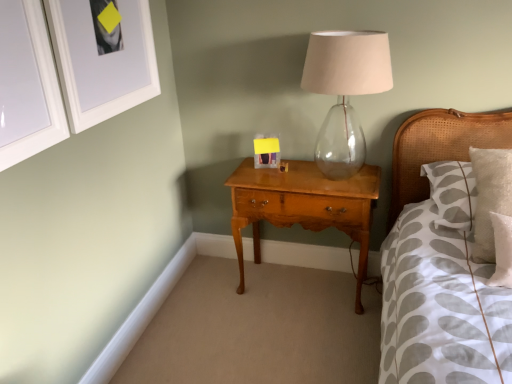
Question: From a real-world perspective, is white matte picture frame at upper left, acting as the second picture frame starting from the left, over matte plastic picture frame at center, marked as the 1th picture frame in a back-to-front arrangement?

Choices:
 (A) no
 (B) yes

Answer: (B)

Question: Can you confirm if white matte picture frame at upper left, acting as the second picture frame starting from the left, is positioned to the right of matte plastic picture frame at center, placed as the third picture frame when sorted from left to right?

Choices:
 (A) yes
 (B) no

Answer: (B)

Question: Can matte plastic picture frame at center, marked as the 1th picture frame in a back-to-front arrangement, be found inside white matte picture frame at upper left, acting as the second picture frame starting from the left?

Choices:
 (A) yes
 (B) no

Answer: (B)

Question: From the image's perspective, is white matte picture frame at upper left, arranged as the 2th picture frame when viewed from the front, above matte plastic picture frame at center, marked as the 3th picture frame in a front-to-back arrangement?

Choices:
 (A) no
 (B) yes

Answer: (B)

Question: From a real-world perspective, is white matte picture frame at upper left, arranged as the 2th picture frame when viewed from the front, physically below matte plastic picture frame at center, marked as the 1th picture frame in a back-to-front arrangement?

Choices:
 (A) yes
 (B) no

Answer: (B)

Question: Does white matte picture frame at upper left, acting as the second picture frame starting from the left, have a larger size compared to matte plastic picture frame at center, marked as the 1th picture frame in a back-to-front arrangement?

Choices:
 (A) yes
 (B) no

Answer: (A)

Question: Can you confirm if transparent glass table lamp at center is wider than white matte picture frame at upper left, arranged as the 2th picture frame when viewed from the front?

Choices:
 (A) no
 (B) yes

Answer: (B)

Question: Is transparent glass table lamp at center placed right next to white matte picture frame at upper left, acting as the second picture frame starting from the left?

Choices:
 (A) no
 (B) yes

Answer: (A)

Question: Is transparent glass table lamp at center far from white matte picture frame at upper left, the second picture frame from the back?

Choices:
 (A) no
 (B) yes

Answer: (A)

Question: From a real-world perspective, is transparent glass table lamp at center located beneath white matte picture frame at upper left, acting as the second picture frame starting from the left?

Choices:
 (A) no
 (B) yes

Answer: (B)

Question: Is transparent glass table lamp at center positioned behind white matte picture frame at upper left, the second picture frame from the back?

Choices:
 (A) yes
 (B) no

Answer: (A)

Question: From a real-world perspective, does transparent glass table lamp at center stand above white matte picture frame at upper left, acting as the second picture frame starting from the left?

Choices:
 (A) yes
 (B) no

Answer: (B)

Question: Would you say shiny brown wood nightstand at center is outside matte plastic picture frame at center, marked as the 1th picture frame in a back-to-front arrangement?

Choices:
 (A) yes
 (B) no

Answer: (A)